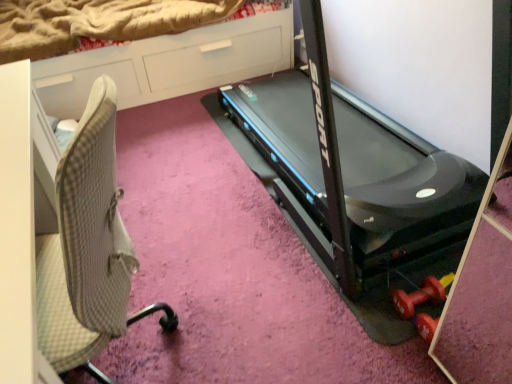
Question: Considering the positions of beige fabric chair at left and white glossy dresser at upper left in the image, is beige fabric chair at left taller or shorter than white glossy dresser at upper left?

Choices:
 (A) short
 (B) tall

Answer: (B)

Question: From the image's perspective, is beige fabric chair at left positioned above or below white glossy dresser at upper left?

Choices:
 (A) below
 (B) above

Answer: (A)

Question: Which of these objects is positioned farthest from the black plastic treadmill at center?

Choices:
 (A) beige fabric chair at left
 (B) white glossy dresser at upper left

Answer: (A)

Question: Which object is positioned closest to the white glossy dresser at upper left?

Choices:
 (A) beige fabric chair at left
 (B) black plastic treadmill at center

Answer: (B)